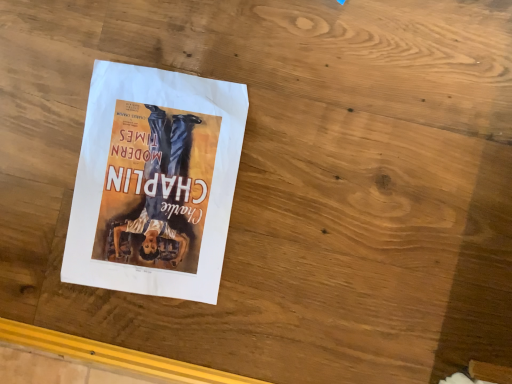
Question: Should I look upward or downward to see white paper poster at center?

Choices:
 (A) down
 (B) up

Answer: (B)